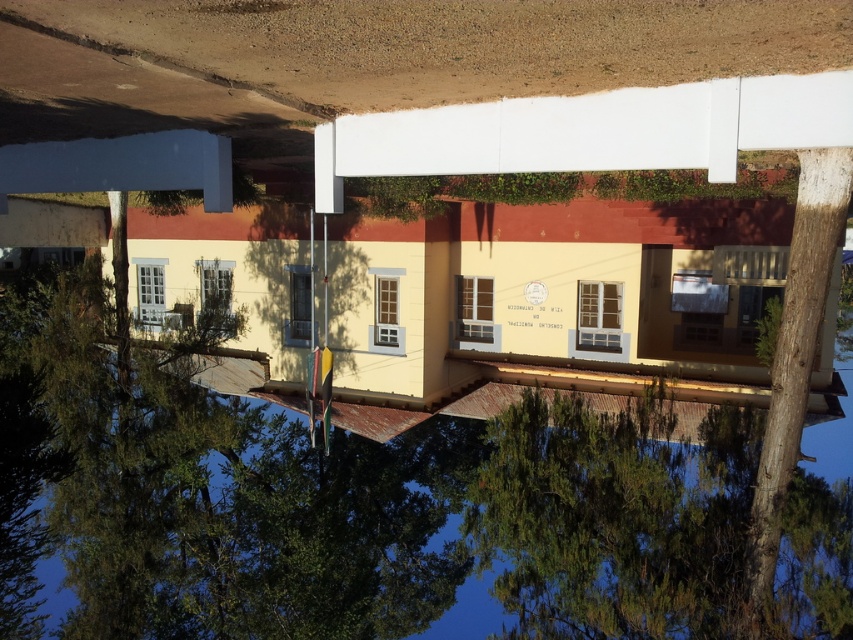
You are a gardener who needs to water the smooth brown tree trunk at right. You have a watering can filled with transparent plastic water at center. Can you pour the water directly onto the tree trunk without moving the water container?

The transparent plastic water at center is positioned under the smooth brown tree trunk at right, so pouring the water directly onto the tree trunk from the transparent plastic water at center would be possible since it is already located beneath the trunk.

You are a visitor at this building and want to take a photo that includes both the transparent plastic water at center and the smooth brown tree trunk at right. Which object should you position closer to the camera to ensure both are visible in the frame?

Since the transparent plastic water at center is larger in size than the smooth brown tree trunk at right, you should position the smooth brown tree trunk at right closer to the camera to ensure both objects are visible in the frame.

In the scene shown: You are standing in front of the building and see the transparent plastic water at center and the smooth brown tree trunk at right. Which object is closer to your left side?

The transparent plastic water at center is closer to your left side because it is positioned to the left of the smooth brown tree trunk at right.